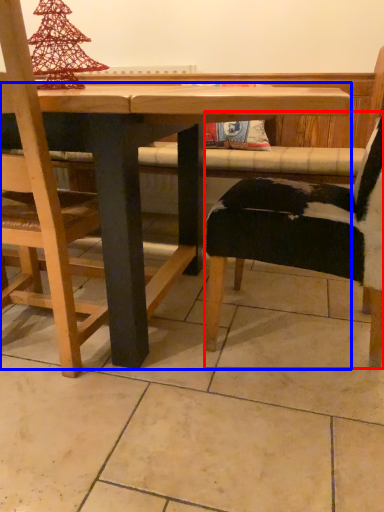
Question: Among these objects, which one is farthest to the camera, chair (highlighted by a red box) or table (highlighted by a blue box)?

Choices:
 (A) chair
 (B) table

Answer: (A)